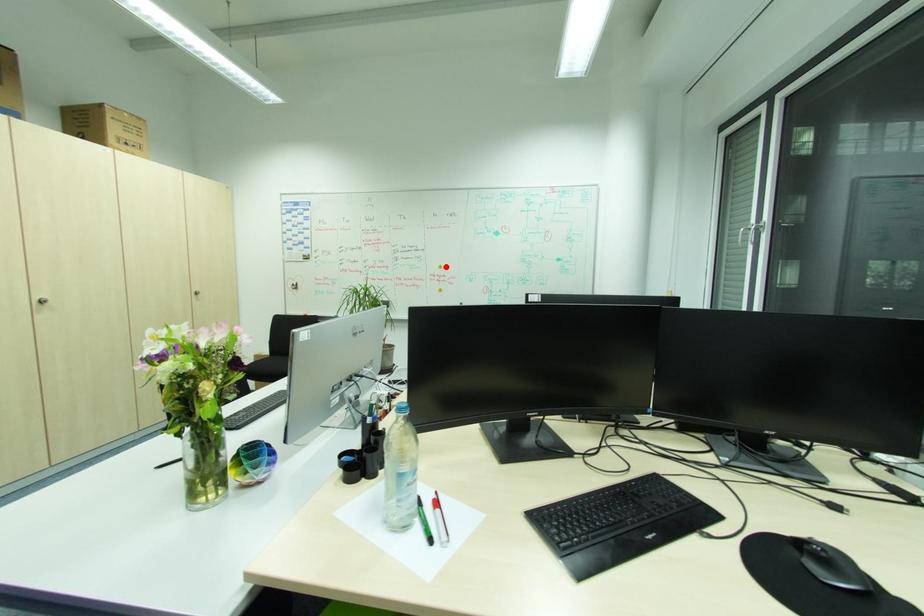
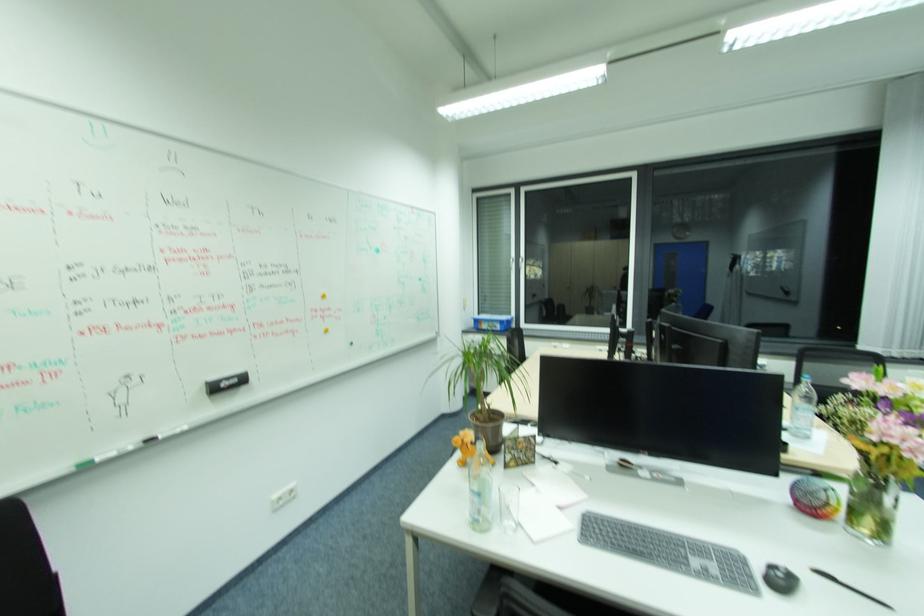
Find the pixel in the second image that matches the highlighted location in the first image.

(329, 296)